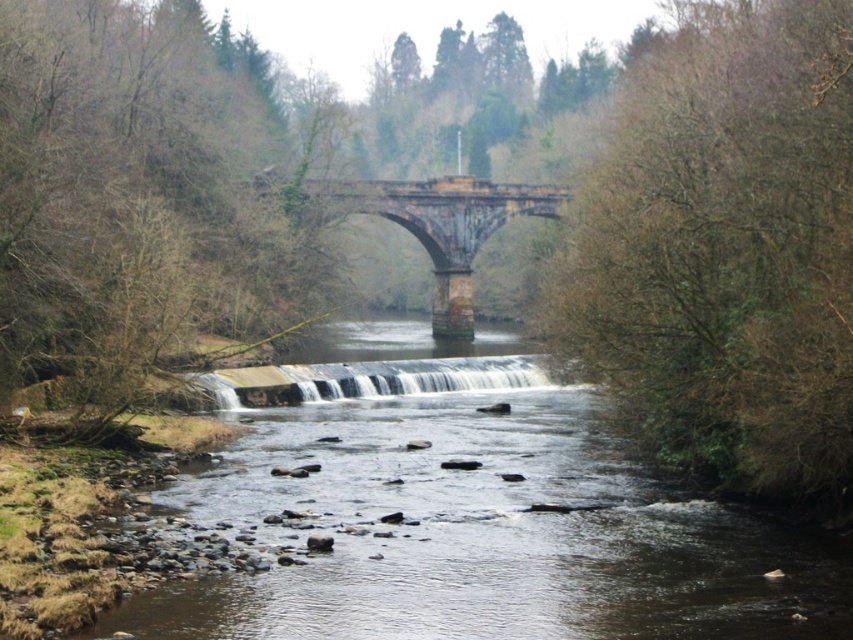
Who is higher up, brown leafless tree at left or white textured water at center?

brown leafless tree at left

Image resolution: width=853 pixels, height=640 pixels. Describe the element at coordinates (131, 204) in the screenshot. I see `brown leafless tree at left` at that location.

Does point (134, 83) come in front of point (386, 364)?

No, it is behind (386, 364).

This screenshot has width=853, height=640. Identify the location of brown leafless tree at left. (131, 204).

Does bare branches at right appear over white textured water at center?

Correct, bare branches at right is located above white textured water at center.

Is point (635, 301) closer to camera compared to point (496, 368)?

That is True.

Locate an element on the screen. The image size is (853, 640). bare branches at right is located at coordinates (724, 250).

I want to click on bare branches at right, so click(x=724, y=250).

Between bare branches at right and rusty stone bridge at center, which one is positioned higher?

rusty stone bridge at center is above.

Is point (775, 480) farther from viewer compared to point (554, 193)?

No, (775, 480) is in front of (554, 193).

You are a GUI agent. You are given a task and a screenshot of the screen. Output one action in this format:
    pyautogui.click(x=<x>, y=<y>)
    Task: Click on the bare branches at right
    This screenshot has height=640, width=853.
    Given the screenshot: What is the action you would take?
    pyautogui.click(x=724, y=250)